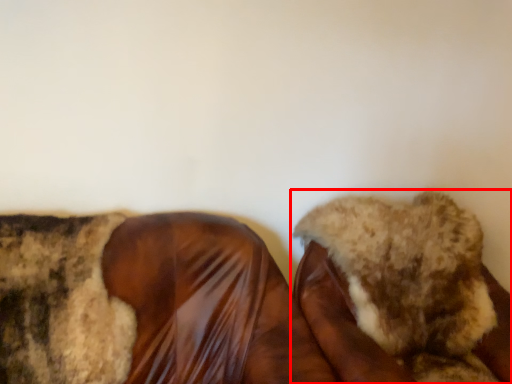
Question: Considering the relative positions of footwear (annotated by the red box) and footwear in the image provided, where is footwear (annotated by the red box) located with respect to the staircase?

Choices:
 (A) left
 (B) right

Answer: (B)